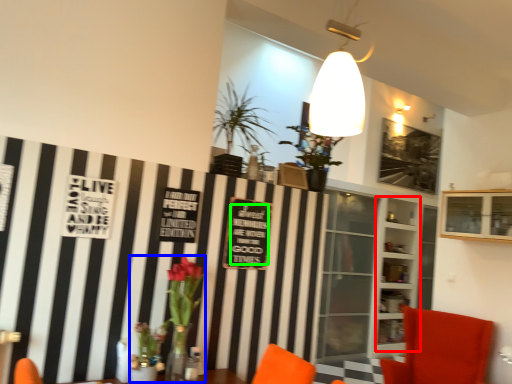
Question: Which is farther away from shelf (highlighted by a red box)? floral arrangement (highlighted by a blue box) or writing (highlighted by a green box)?

Choices:
 (A) floral arrangement
 (B) writing

Answer: (A)